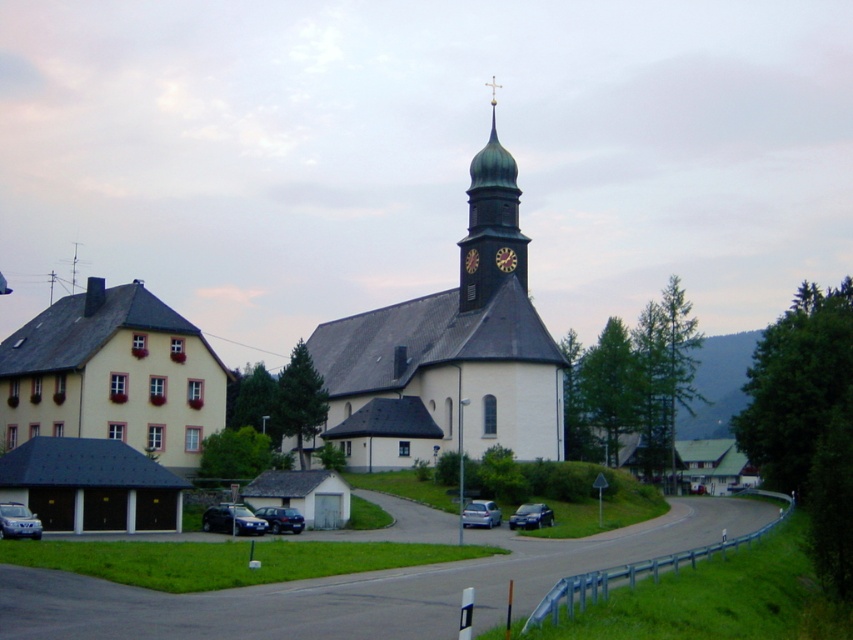
You are a delivery driver who needs to park your truck between the metallic blue sedan at lower left and the silver metallic sedan at lower center. Your truck is 20 feet long. Is there enough space between them to park your truck?

The metallic blue sedan at lower left and silver metallic sedan at lower center are 43.31 feet apart from each other. Since your truck is 20 feet long, there is sufficient space between them to park your truck.

Consider the image. You are driving a metallic blue sedan at lower center and want to park it closer to the smooth white church at center. Which direction should you move your car to align it directly in front of the church?

The smooth white church at center is to the right of the metallic blue sedan at lower center, so you should move your car to the right to align it directly in front of the church.